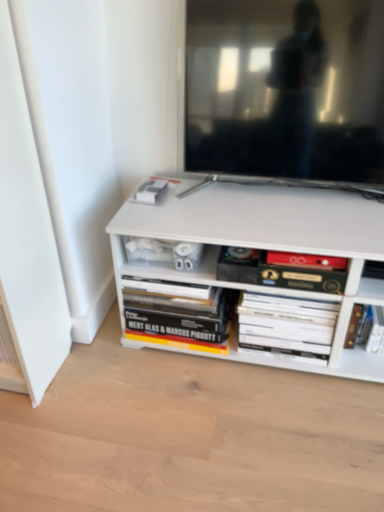
Question: In terms of height, does white matte book at center, which is the 2th book from right to left, look taller or shorter compared to hardcover book at lower center, which is the 1th book from left to right?

Choices:
 (A) short
 (B) tall

Answer: (B)

Question: Considering their positions, is white matte book at center, which is the 2th book from right to left, located in front of or behind hardcover book at lower center, which is the fourth book in right-to-left order?

Choices:
 (A) front
 (B) behind

Answer: (A)

Question: Which of these objects is positioned farthest from the hardcover book at center, which is the 2th book from left to right?

Choices:
 (A) white matte book at center, the third book positioned from the left
 (B) hardcover book at lower right, which is the 1th book in right-to-left order
 (C) matte black tv at upper center
 (D) hardcover book at lower center, which is the fourth book in right-to-left order

Answer: (C)

Question: Which object is the farthest from the hardcover book at lower center, which is the 1th book from left to right?

Choices:
 (A) hardcover book at center, which is the 2th book from left to right
 (B) white matte book at center, which is the 2th book from right to left
 (C) hardcover book at lower right, positioned as the 4th book in left-to-right order
 (D) matte black tv at upper center

Answer: (D)